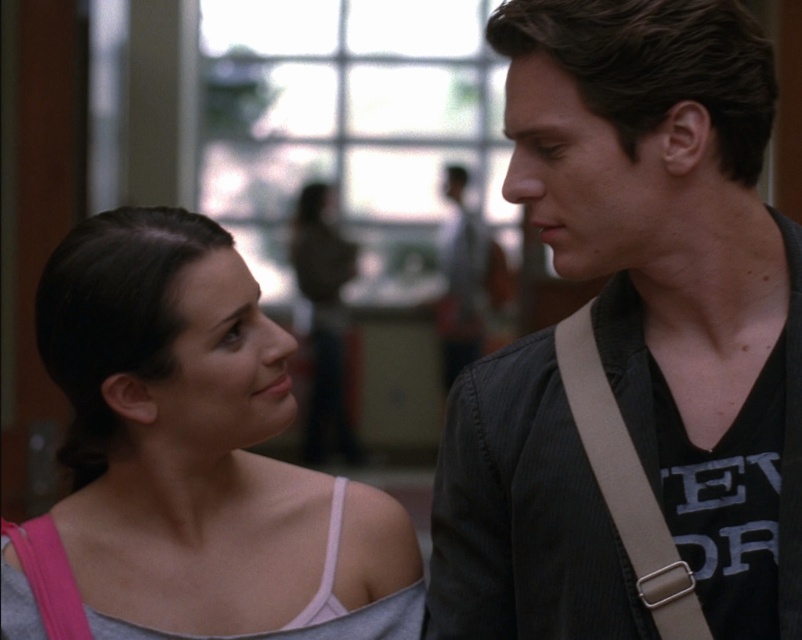
Question: Which point is closer to the camera?

Choices:
 (A) (646, 554)
 (B) (221, 397)

Answer: (A)

Question: In this image, where is dark gray corduroy jacket at center located relative to tan fabric strap at right?

Choices:
 (A) left
 (B) right

Answer: (B)

Question: Which object is closer to the camera taking this photo?

Choices:
 (A) tan fabric strap at right
 (B) dark gray corduroy jacket at center
 (C) gray fabric tank top at left

Answer: (B)

Question: Is gray fabric tank top at left closer to the viewer compared to tan fabric strap at right?

Choices:
 (A) no
 (B) yes

Answer: (A)

Question: Does dark gray corduroy jacket at center appear over tan fabric strap at right?

Choices:
 (A) yes
 (B) no

Answer: (A)

Question: Which object is positioned farthest from the dark gray corduroy jacket at center?

Choices:
 (A) gray fabric tank top at left
 (B) tan fabric strap at right

Answer: (A)